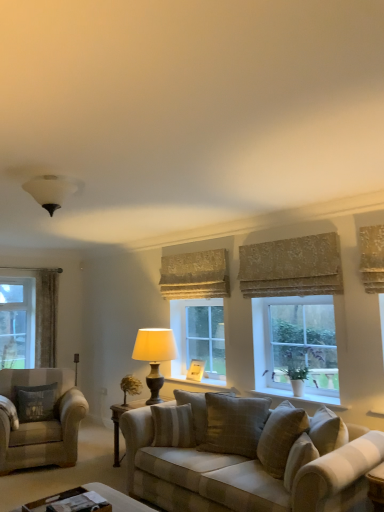
This screenshot has width=384, height=512. I want to click on vacant area on top of clear glass window at center (from a real-world perspective), so click(x=309, y=297).